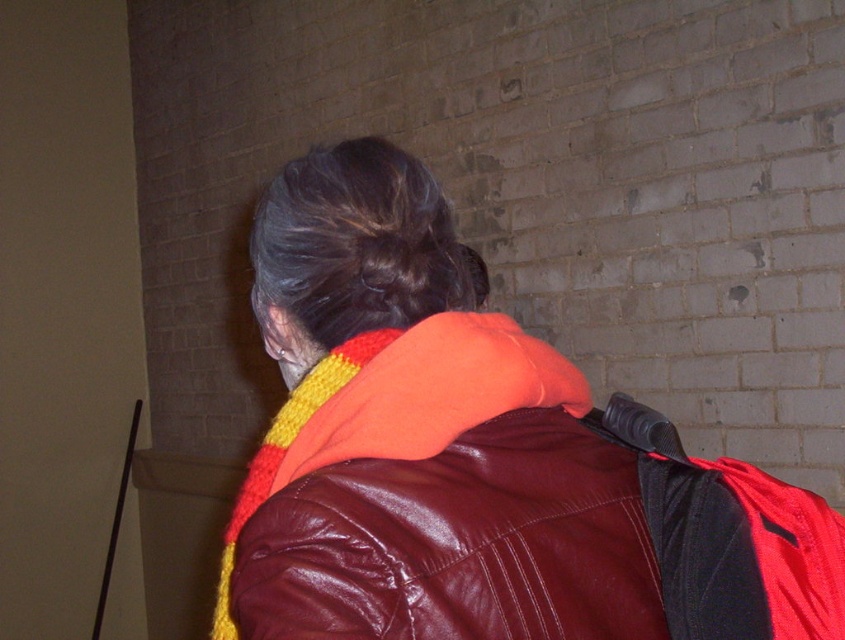
You are trying to determine if the leather jacket at center can be hung on a coat rack located behind the black leather backpack at upper right. Based on their positions, is this possible?

The leather jacket at center is positioned over the black leather backpack at upper right, meaning the jacket is closer to you than the backpack. Since the coat rack is behind the backpack, the jacket would need to be moved to access the rack, making it impossible to hang it there without repositioning.

You are a photographer trying to capture a portrait of the person with dark brown hair at center. The camera you are using has a minimum focusing distance of 60 centimeters. Can you take the photo without moving closer than the minimum focusing distance?

The person with dark brown hair at center is 70.69 centimeters away, which is beyond the camera minimum focusing distance of 60 centimeters. Therefore, you can take the photo without moving closer.

You are trying to decide whether to wear the leather jacket at center with the black leather backpack at upper right. Based on their sizes, will the jacket be more or less noticeable when worn together?

The leather jacket at center is wider than the black leather backpack at upper right, so the jacket will be more noticeable when worn together.